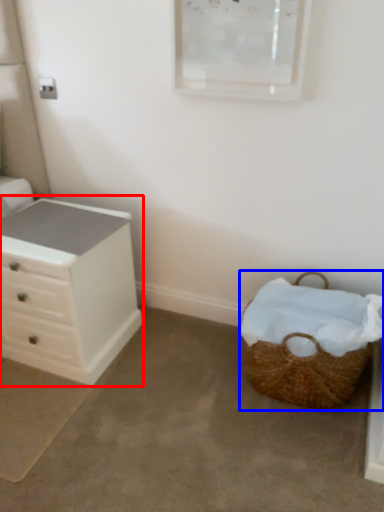
Question: Among these objects, which one is nearest to the camera, chest of drawers (highlighted by a red box) or picnic basket (highlighted by a blue box)?

Choices:
 (A) chest of drawers
 (B) picnic basket

Answer: (B)